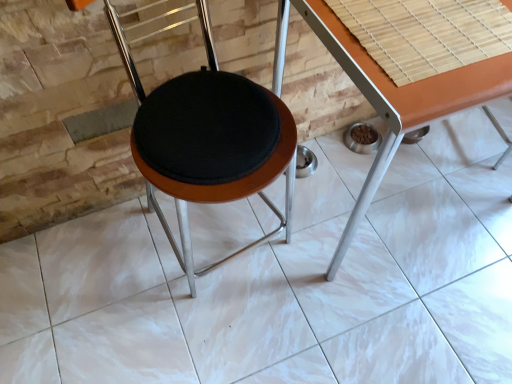
Question: Is bamboo mat at upper right to the right of orange laminate table at center from the viewer's perspective?

Choices:
 (A) no
 (B) yes

Answer: (A)

Question: From the image's perspective, is bamboo mat at upper right below orange laminate table at center?

Choices:
 (A) no
 (B) yes

Answer: (A)

Question: Does bamboo mat at upper right have a greater height compared to orange laminate table at center?

Choices:
 (A) yes
 (B) no

Answer: (B)

Question: Is bamboo mat at upper right closer to camera compared to orange laminate table at center?

Choices:
 (A) no
 (B) yes

Answer: (A)

Question: Could you tell me if bamboo mat at upper right is facing orange laminate table at center?

Choices:
 (A) yes
 (B) no

Answer: (A)

Question: Can you confirm if bamboo mat at upper right is bigger than orange laminate table at center?

Choices:
 (A) no
 (B) yes

Answer: (A)

Question: From a real-world perspective, does bamboo mat at upper right stand above black fabric cushion at center?

Choices:
 (A) no
 (B) yes

Answer: (B)

Question: Is bamboo mat at upper right placed right next to black fabric cushion at center?

Choices:
 (A) yes
 (B) no

Answer: (B)

Question: From a real-world perspective, is bamboo mat at upper right positioned under black fabric cushion at center based on gravity?

Choices:
 (A) yes
 (B) no

Answer: (B)

Question: Does bamboo mat at upper right have a greater height compared to black fabric cushion at center?

Choices:
 (A) yes
 (B) no

Answer: (B)

Question: Could black fabric cushion at center be considered to be inside bamboo mat at upper right?

Choices:
 (A) no
 (B) yes

Answer: (A)

Question: From the image's perspective, is bamboo mat at upper right over black fabric cushion at center?

Choices:
 (A) yes
 (B) no

Answer: (A)

Question: Considering the relative sizes of black fabric cushion at center and orange laminate table at center in the image provided, is black fabric cushion at center thinner than orange laminate table at center?

Choices:
 (A) no
 (B) yes

Answer: (B)